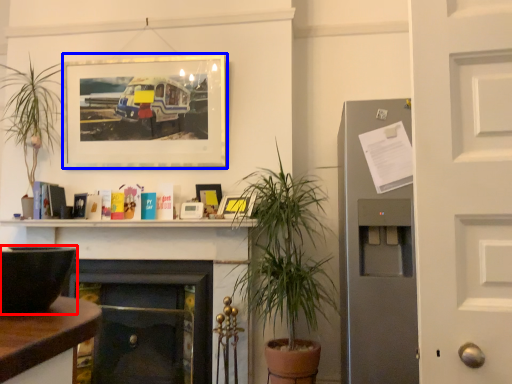
Question: Which of the following is the closest to the observer, appliance (highlighted by a red box) or picture frame (highlighted by a blue box)?

Choices:
 (A) appliance
 (B) picture frame

Answer: (A)